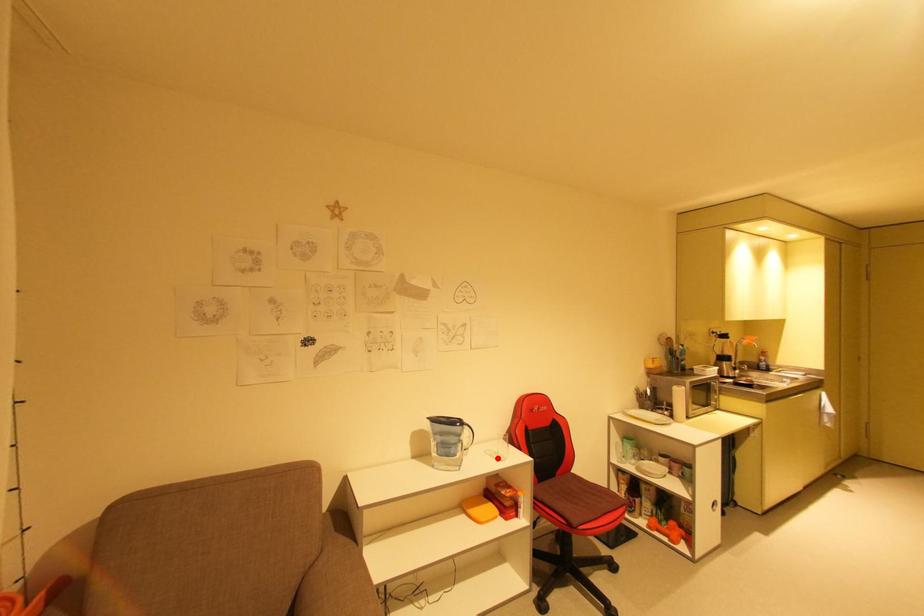
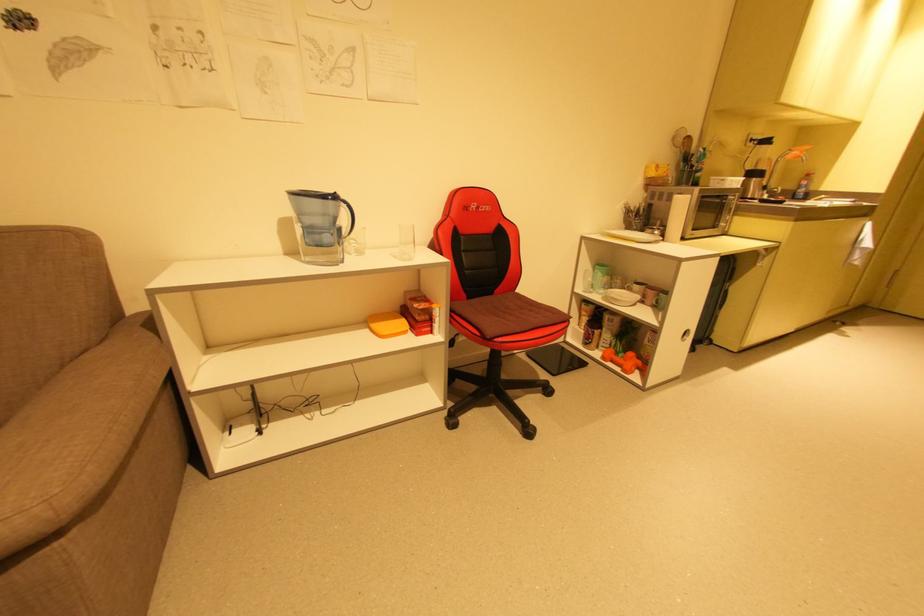
Question: I am providing you with two images of the same scene from different viewpoints. Image1 has a red point marked. In image2, the corresponding 3D location appears at what relative position? Reply with the corresponding letter.

Choices:
 (A) Closer
 (B) Farther

Answer: (A)